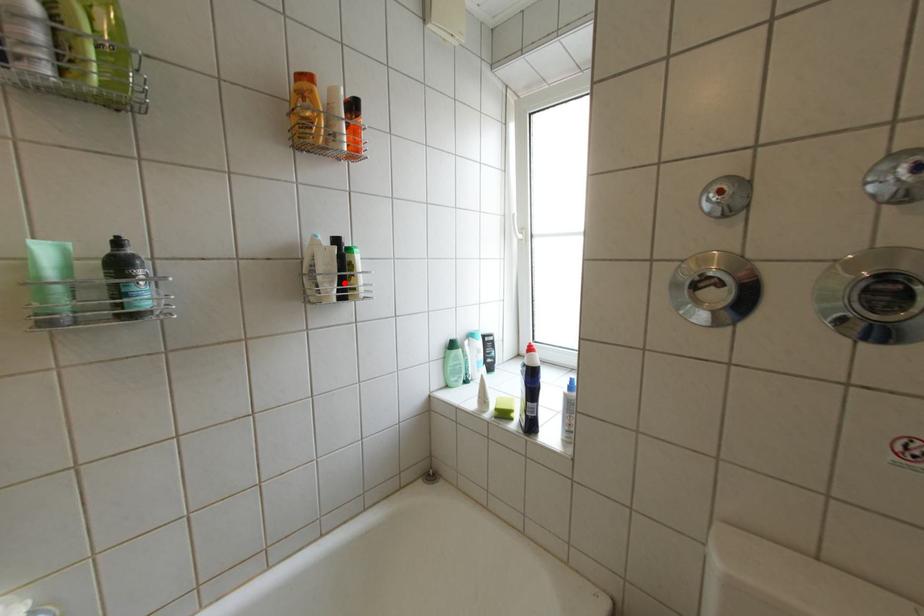
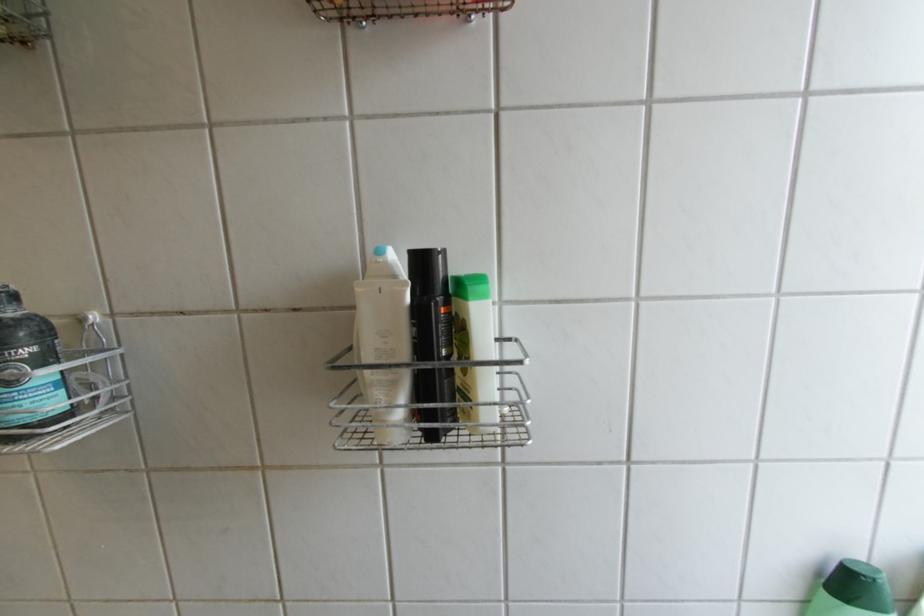
The point at the highlighted location is marked in the first image. Where is the corresponding point in the second image?

(407, 387)